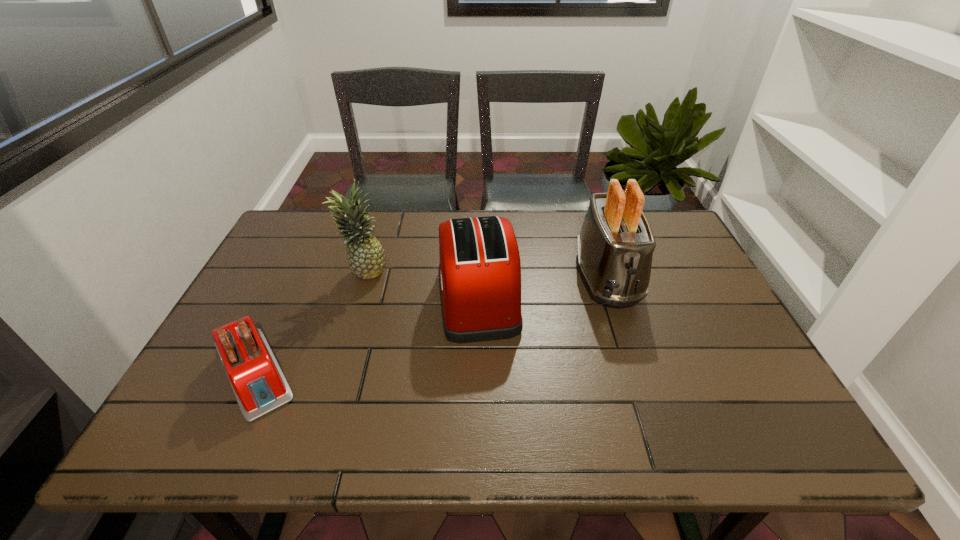
The image size is (960, 540). I want to click on vacant space located 0.080m on the right of the leftmost toaster, so click(x=339, y=373).

Find the location of a particular element. The height and width of the screenshot is (540, 960). object that is at the far edge is located at coordinates (616, 243).

Locate an element on the screen. object that is positioned at the near edge is located at coordinates (259, 385).

At what (x,y) coordinates should I click in order to perform the action: click on object that is at the left edge. Please return your answer as a coordinate pair (x, y). The image size is (960, 540). Looking at the image, I should click on (259, 385).

You are a GUI agent. You are given a task and a screenshot of the screen. Output one action in this format:
    pyautogui.click(x=<x>, y=<y>)
    Task: Click on the object that is at the near left corner
    
    Given the screenshot: What is the action you would take?
    pyautogui.click(x=259, y=385)

What are the coordinates of `vacant space at the far edge of the desktop` in the screenshot? It's located at (515, 225).

What are the coordinates of `blank space at the near edge of the desktop` in the screenshot? It's located at pyautogui.click(x=704, y=448).

The width and height of the screenshot is (960, 540). What are the coordinates of `vacant space at the left edge` in the screenshot? It's located at (208, 398).

Find the location of `free space at the right edge of the desktop`. free space at the right edge of the desktop is located at coordinates (732, 371).

The image size is (960, 540). I want to click on vacant space at the far left corner, so click(289, 219).